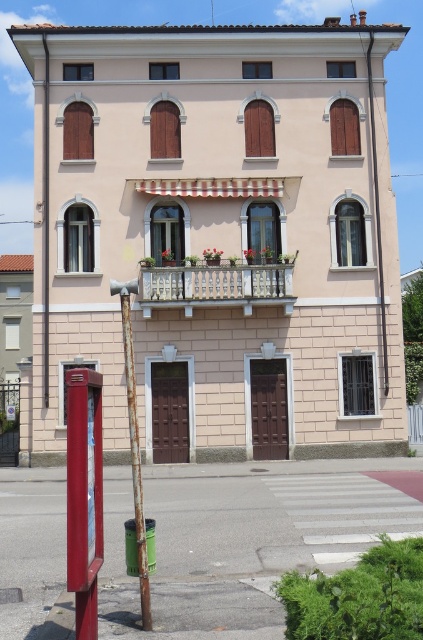
Is rusty metal pole at center closer to the viewer compared to white wood shutter at left?

Yes, it is in front of white wood shutter at left.

In the scene shown: How much distance is there between rusty metal pole at center and white wood shutter at left?

rusty metal pole at center is 1.70 meters away from white wood shutter at left.

This screenshot has width=423, height=640. Identify the location of rusty metal pole at center. (134, 445).

Who is positioned more to the right, white painted wood balcony at center or rusty metal pole at center?

white painted wood balcony at center is more to the right.

In the scene shown: Is white painted wood balcony at center bigger than rusty metal pole at center?

No.

Between point (217, 304) and point (115, 292), which one is positioned in front?

Point (115, 292)

The height and width of the screenshot is (640, 423). Find the location of `white painted wood balcony at center`. white painted wood balcony at center is located at coordinates (216, 288).

How distant is white wood shutter at left from brown wooden shutter at center?

A distance of 16.35 feet exists between white wood shutter at left and brown wooden shutter at center.

The width and height of the screenshot is (423, 640). What do you see at coordinates (79, 237) in the screenshot? I see `white wood shutter at left` at bounding box center [79, 237].

This screenshot has width=423, height=640. I want to click on white wood shutter at left, so click(x=79, y=237).

The height and width of the screenshot is (640, 423). I want to click on white wood shutter at left, so click(x=79, y=237).